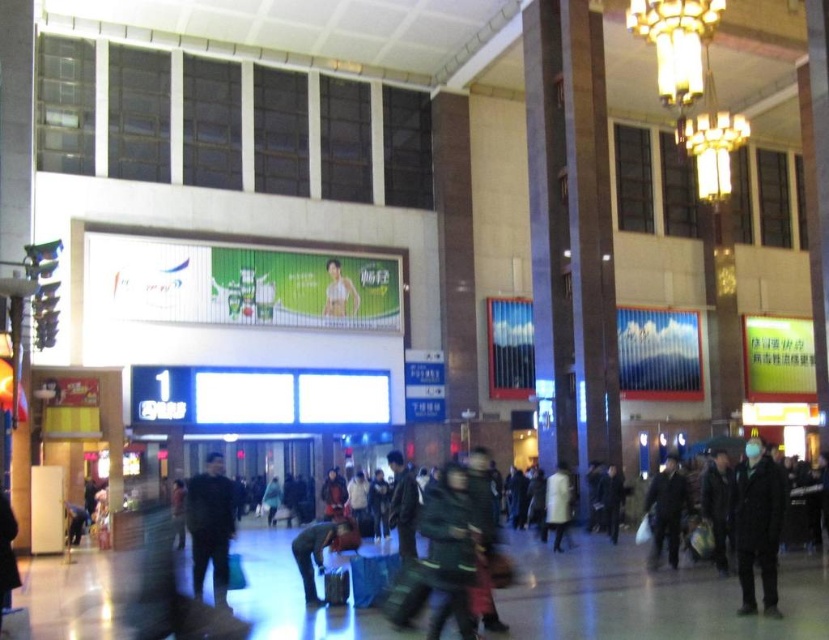
Is dark matte clothing at center positioned in front of dark green jacket at center?

Yes, dark matte clothing at center is in front of dark green jacket at center.

Which of these two, dark matte clothing at center or dark green jacket at center, stands shorter?

dark green jacket at center is shorter.

Between point (624, 557) and point (391, 502), which one is positioned behind?

Point (624, 557)

At what (x,y) coordinates should I click in order to perform the action: click on dark matte clothing at center. Please return your answer as a coordinate pair (x, y). The width and height of the screenshot is (829, 640). Looking at the image, I should click on (648, 596).

Between dark gray wool coat at lower right and dark gray jacket at center, which one has less height?

dark gray jacket at center

Does dark gray wool coat at lower right appear over dark gray jacket at center?

Indeed, dark gray wool coat at lower right is positioned over dark gray jacket at center.

Who is more forward, [750,528] or [711,528]?

Point [750,528] is more forward.

You are a GUI agent. You are given a task and a screenshot of the screen. Output one action in this format:
    pyautogui.click(x=<x>, y=<y>)
    Task: Click on the dark gray wool coat at lower right
    The image size is (829, 640).
    Given the screenshot: What is the action you would take?
    pyautogui.click(x=757, y=525)

Does dark gray coat at center appear on the right side of green fabric bikini at center?

Yes, dark gray coat at center is to the right of green fabric bikini at center.

Does dark gray coat at center lie behind green fabric bikini at center?

No, dark gray coat at center is closer to the viewer.

Who is more forward, [670,508] or [357,298]?

Point [670,508] is more forward.

This screenshot has height=640, width=829. I want to click on dark gray coat at center, so click(x=667, y=509).